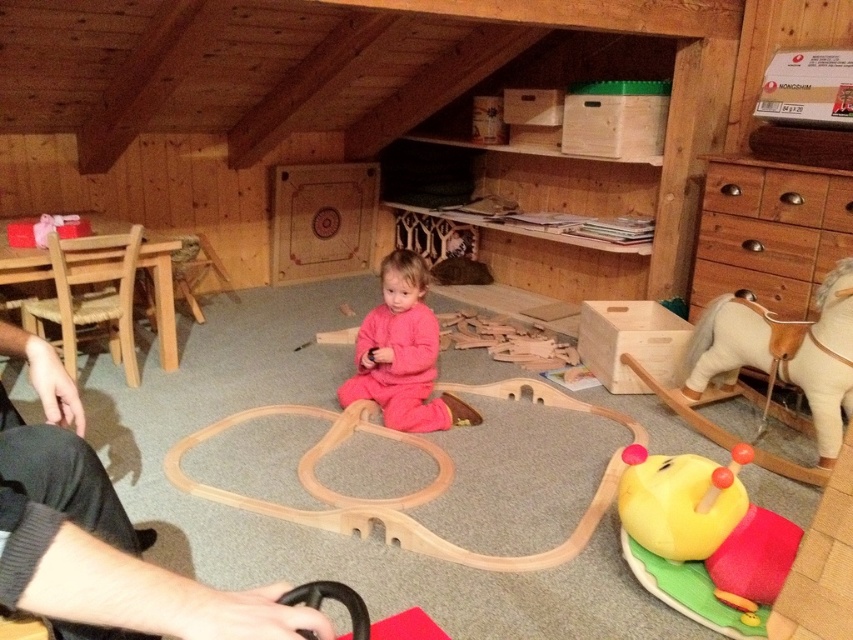
Who is higher up, wooden drawer at right or pink fleece baby at center?

Positioned higher is wooden drawer at right.

Who is shorter, wooden drawer at right or pink fleece baby at center?

Standing shorter between the two is wooden drawer at right.

Is point (831, 234) positioned in front of point (403, 294)?

That is False.

Locate an element on the screen. The width and height of the screenshot is (853, 640). wooden drawer at right is located at coordinates pyautogui.click(x=769, y=234).

Between black fabric at lower left and pink fleece baby at center, which one has more height?

pink fleece baby at center is taller.

Is black fabric at lower left to the left of pink fleece baby at center from the viewer's perspective?

Indeed, black fabric at lower left is positioned on the left side of pink fleece baby at center.

At what (x,y) coordinates should I click in order to perform the action: click on black fabric at lower left. Please return your answer as a coordinate pair (x, y). The width and height of the screenshot is (853, 640). Looking at the image, I should click on (102, 538).

Where is `black fabric at lower left`? black fabric at lower left is located at coordinates (102, 538).

Can you confirm if wooden drawer at right is positioned below wooden rocking horse at right?

No.

At what (x,y) coordinates should I click in order to perform the action: click on wooden drawer at right. Please return your answer as a coordinate pair (x, y). Looking at the image, I should click on (769, 234).